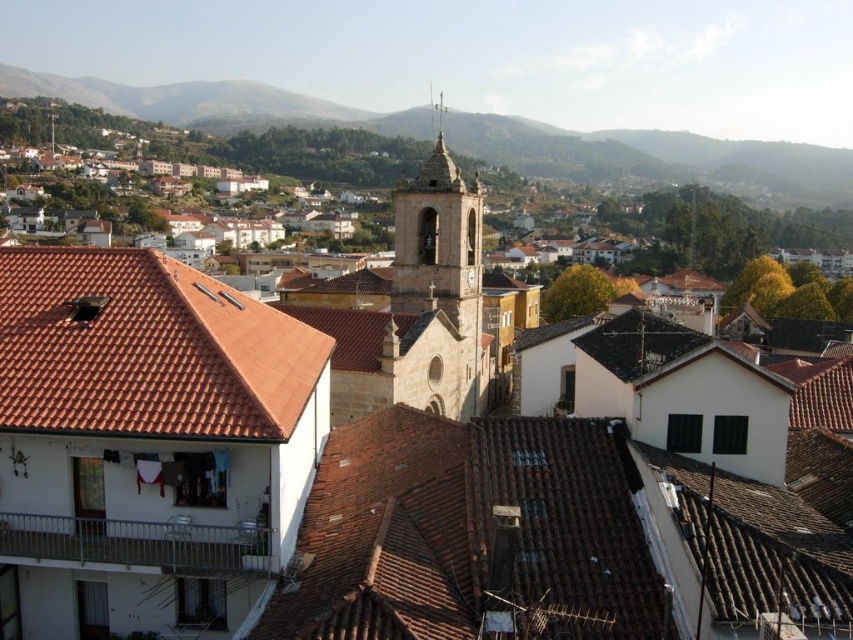
Question: Which point is closer to the camera?

Choices:
 (A) (27, 385)
 (B) (442, 129)
 (C) (456, 246)

Answer: (A)

Question: Considering the relative positions of red tile roof at left and stone bell tower at center in the image provided, where is red tile roof at left located with respect to stone bell tower at center?

Choices:
 (A) right
 (B) left

Answer: (B)

Question: In this image, where is red tile roof at left located relative to stone bell tower at center?

Choices:
 (A) right
 (B) left

Answer: (B)

Question: Which object is closer to the camera taking this photo?

Choices:
 (A) shiny silver spire at upper center
 (B) red tile roof at left

Answer: (B)

Question: Does stone bell tower at center appear on the left side of shiny silver spire at upper center?

Choices:
 (A) no
 (B) yes

Answer: (B)

Question: Which point is farther from the camera taking this photo?

Choices:
 (A) (383, 340)
 (B) (172, 397)
 (C) (430, 84)

Answer: (C)